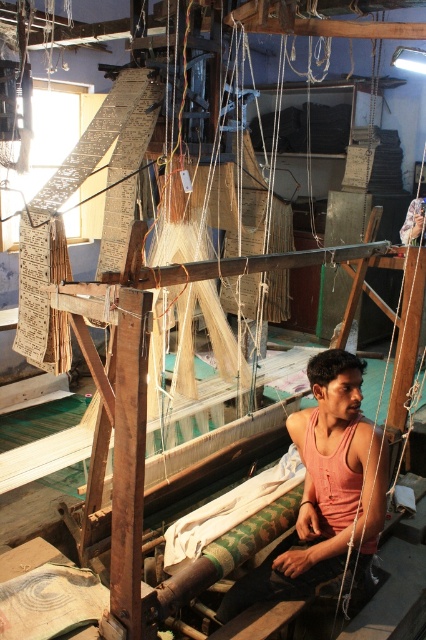
Measure the distance between pink cotton tank top at center and green woven cloth at center.

pink cotton tank top at center is 36.38 centimeters away from green woven cloth at center.

This screenshot has width=426, height=640. Find the location of `pink cotton tank top at center`. pink cotton tank top at center is located at coordinates (325, 490).